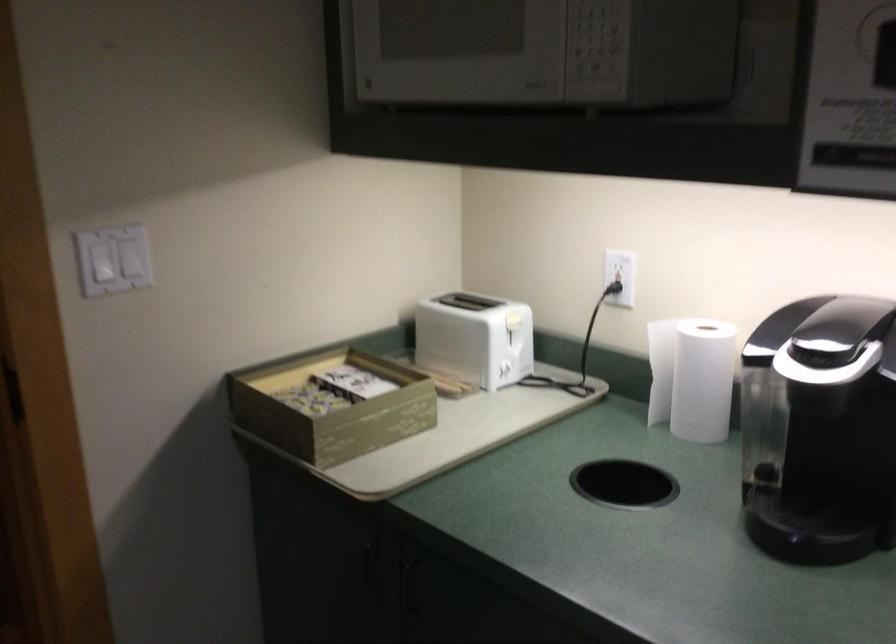
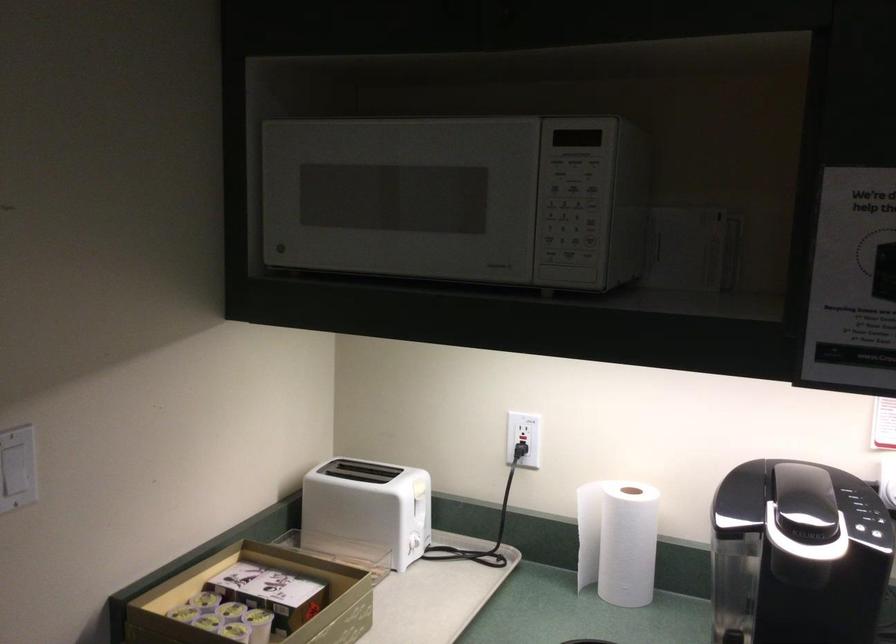
Question: I am providing you with two images of the same scene from different viewpoints. Please identify which objects are invisible in image2.

Choices:
 (A) paper towel roll
 (B) coffee machine button
 (C) coffee machine handle
 (D) none of these

Answer: (D)